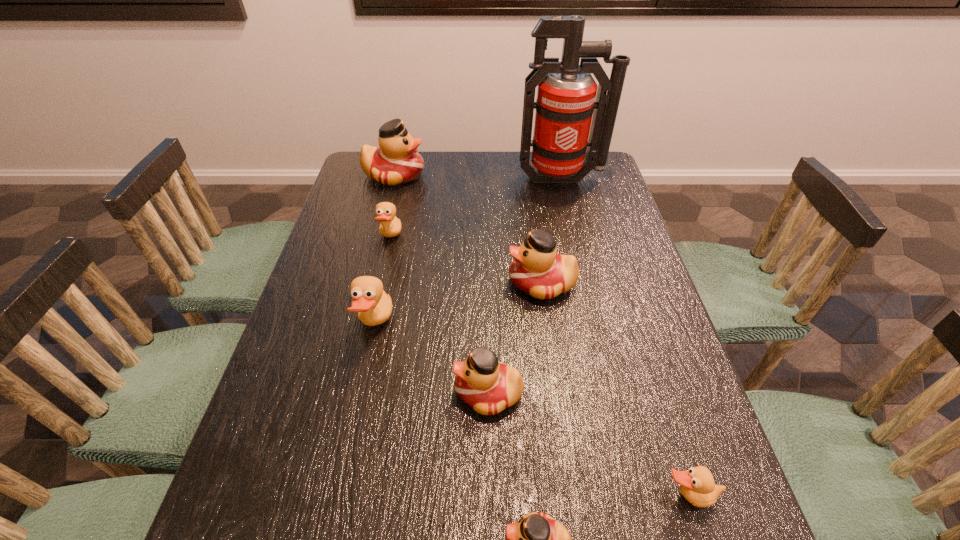
Select which duck appears as the fourth closest to the biggest tan duck. Please provide its 2D coordinates. Your answer should be formatted as a tuple, i.e. [(x, y)], where the tuple contains the x and y coordinates of a point satisfying the conditions above.

[(537, 539)]

This screenshot has height=540, width=960. I want to click on duck that stands as the fourth closest to the nearest object, so click(x=537, y=270).

I want to click on red duck that is the second nearest to the smallest red duck, so click(x=537, y=270).

Locate an element on the screen. The height and width of the screenshot is (540, 960). red duck identified as the third closest to the fifth farthest duck is located at coordinates (396, 161).

Where is `tan duck that is the nearest to the third nearest red duck`? tan duck that is the nearest to the third nearest red duck is located at coordinates (374, 306).

This screenshot has height=540, width=960. Find the location of `tan duck that is the nearest to the smallest red duck`. tan duck that is the nearest to the smallest red duck is located at coordinates (697, 485).

I want to click on free space that satisfies the following two spatial constraints: 1. on the front label side of the tallest object; 2. on the beak of the second farthest tan duck, so click(x=596, y=326).

The image size is (960, 540). Find the location of `vacant space that satisfies the following two spatial constraints: 1. on the front label side of the fire extinguisher; 2. on the face of the third nearest object`. vacant space that satisfies the following two spatial constraints: 1. on the front label side of the fire extinguisher; 2. on the face of the third nearest object is located at coordinates (612, 393).

Locate an element on the screen. The height and width of the screenshot is (540, 960). vacant area in the image that satisfies the following two spatial constraints: 1. on the front label side of the tallest object; 2. on the beak of the biggest tan duck is located at coordinates (596, 326).

Locate an element on the screen. Image resolution: width=960 pixels, height=540 pixels. vacant area in the image that satisfies the following two spatial constraints: 1. on the front label side of the red fire extinguisher; 2. on the face of the sixth farthest object is located at coordinates (612, 393).